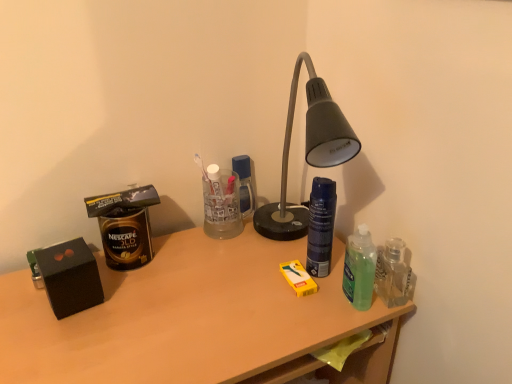
Question: Could you tell me if shiny dark blue spray can at center-right is facing matte black box at left?

Choices:
 (A) yes
 (B) no

Answer: (B)

Question: Considering the relative positions of shiny dark blue spray can at center-right and matte black box at left in the image provided, is shiny dark blue spray can at center-right in front of matte black box at left?

Choices:
 (A) yes
 (B) no

Answer: (B)

Question: Is the position of shiny dark blue spray can at center-right more distant than that of matte black box at left?

Choices:
 (A) yes
 (B) no

Answer: (A)

Question: From a real-world perspective, is shiny dark blue spray can at center-right located beneath matte black box at left?

Choices:
 (A) yes
 (B) no

Answer: (B)

Question: From the image's perspective, does shiny dark blue spray can at center-right appear higher than matte black box at left?

Choices:
 (A) no
 (B) yes

Answer: (B)

Question: Is shiny dark blue spray can at center-right far away from matte black box at left?

Choices:
 (A) no
 (B) yes

Answer: (A)

Question: From the image's perspective, is matte black box at left above shiny dark blue spray can at center-right?

Choices:
 (A) yes
 (B) no

Answer: (B)

Question: Is matte black box at left at the right side of shiny dark blue spray can at center-right?

Choices:
 (A) yes
 (B) no

Answer: (B)

Question: Is the position of matte black box at left more distant than that of shiny dark blue spray can at center-right?

Choices:
 (A) no
 (B) yes

Answer: (A)

Question: Is matte black box at left closer to camera compared to shiny dark blue spray can at center-right?

Choices:
 (A) no
 (B) yes

Answer: (B)

Question: Is matte black box at left located outside shiny dark blue spray can at center-right?

Choices:
 (A) no
 (B) yes

Answer: (B)

Question: Is matte black box at left at the left side of shiny dark blue spray can at center-right?

Choices:
 (A) yes
 (B) no

Answer: (A)

Question: Is point (18, 317) positioned closer to the camera than point (330, 203)?

Choices:
 (A) farther
 (B) closer

Answer: (B)